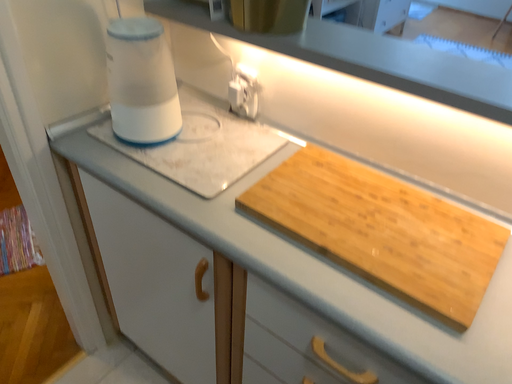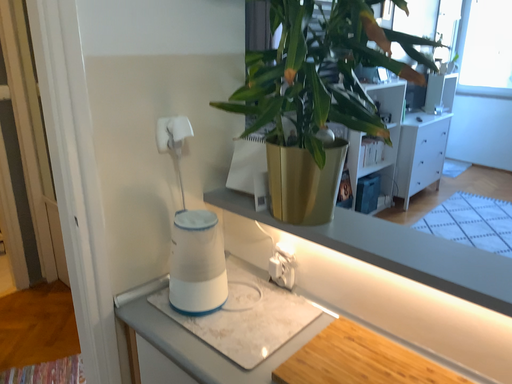
Question: Which way did the camera rotate in the video?

Choices:
 (A) rotated upward
 (B) rotated downward

Answer: (A)